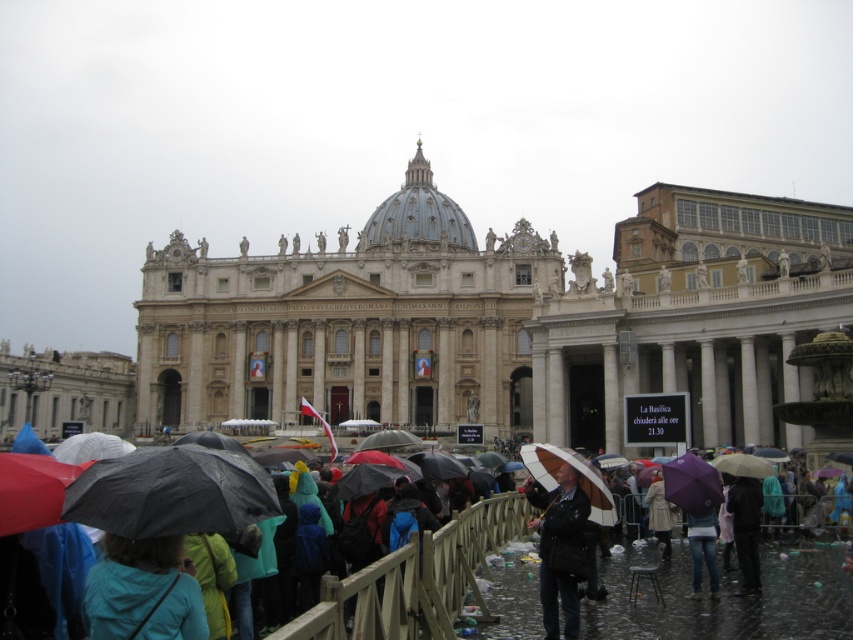
You are a GUI agent. You are given a task and a screenshot of the screen. Output one action in this format:
    pyautogui.click(x=<x>, y=<y>)
    Task: Click on the black matte umbrella at lower left
    The width and height of the screenshot is (853, 640).
    Given the screenshot: What is the action you would take?
    pyautogui.click(x=170, y=492)

Does black matte umbrella at lower left have a lesser height compared to teal fabric jacket at lower left?

Yes.

Who is more distant from viewer, (149, 484) or (178, 540)?

The point (149, 484) is behind.

Locate an element on the screen. The width and height of the screenshot is (853, 640). black matte umbrella at lower left is located at coordinates (170, 492).

Is beige stone basilica at center closer to the viewer compared to black matte umbrella at lower left?

That is False.

Is point (196, 380) in front of point (148, 481)?

No, it is behind (148, 481).

This screenshot has width=853, height=640. What do you see at coordinates (347, 323) in the screenshot?
I see `beige stone basilica at center` at bounding box center [347, 323].

The width and height of the screenshot is (853, 640). I want to click on beige stone basilica at center, so click(347, 323).

Is black matte umbrella at lower left behind black leather jacket at lower right?

No.

What do you see at coordinates (170, 492) in the screenshot? This screenshot has height=640, width=853. I see `black matte umbrella at lower left` at bounding box center [170, 492].

Find the location of a particular element. The height and width of the screenshot is (640, 853). black matte umbrella at lower left is located at coordinates (170, 492).